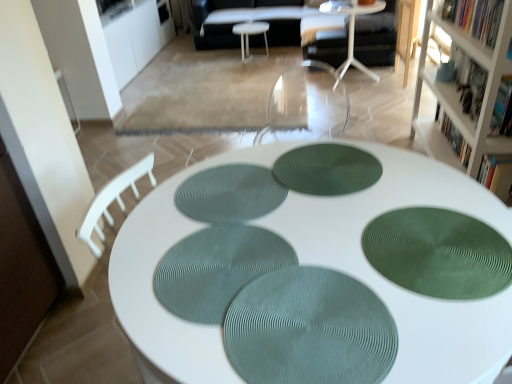
Where is `vacant space behind teal textured placemat at center, the second mat positioned from the left`? This screenshot has width=512, height=384. vacant space behind teal textured placemat at center, the second mat positioned from the left is located at coordinates (228, 202).